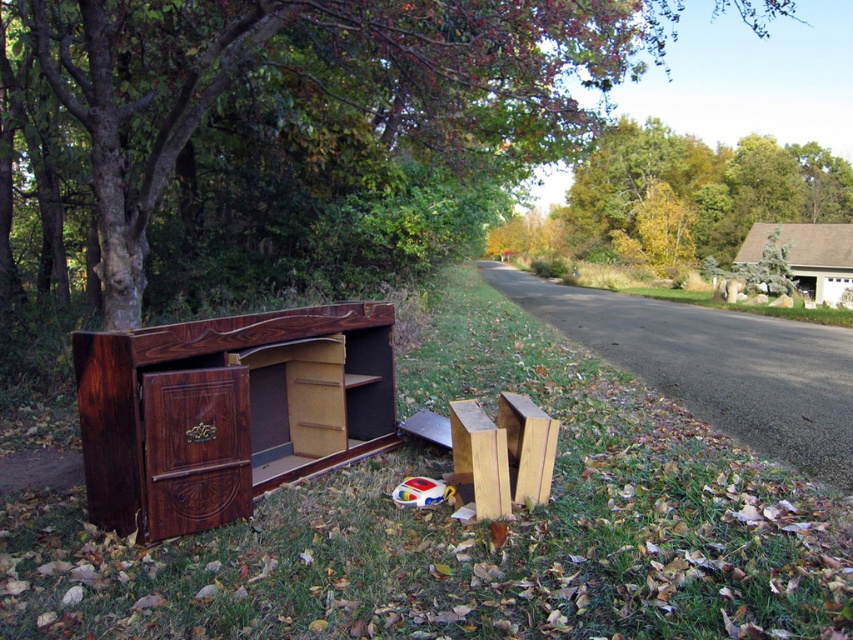
You are standing in the autumn scene and want to pick up the wooden drawer at center and the wooden blocks at lower center. Which object should you reach for first if you want to grab the one nearest to you?

The wooden drawer at center is closer to the viewer than the wooden blocks at lower center, so you should reach for the wooden drawer at center first.

You are a gardener trying to reach the wooden drawer at center from the brown grass at lower left. Which direction should you move to get there?

The brown grass at lower left is to the right of the wooden drawer at center, so you should move to the left to reach the wooden drawer at center from the brown grass at lower left.